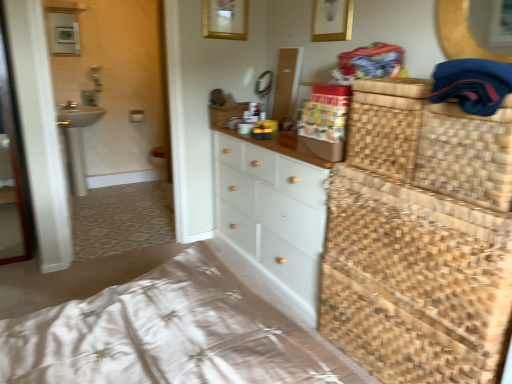
What are the coordinates of `free space on the front side of white ceramic sink at left` in the screenshot? It's located at [91, 210].